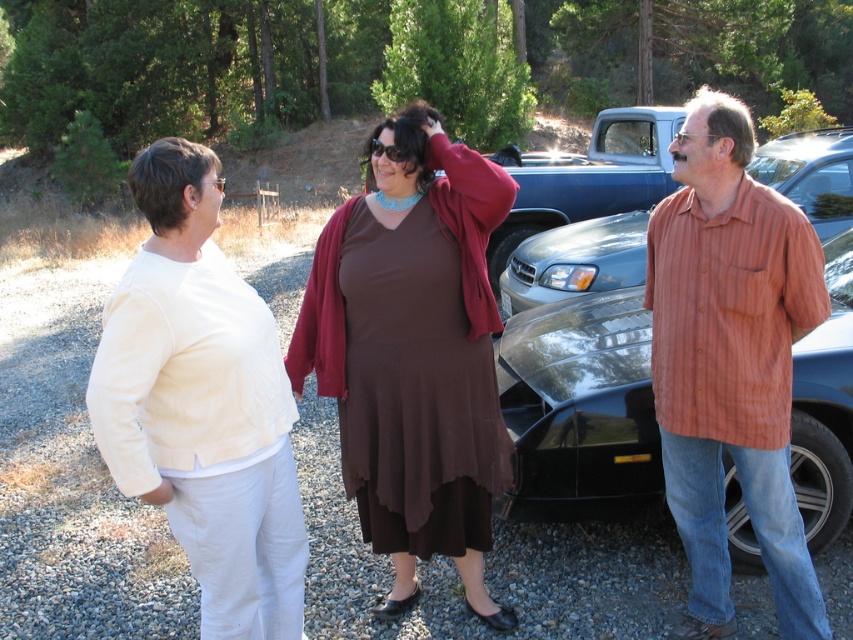
You are a photographer trying to capture a group photo of the two women in the scene. The camera you are using has a focus range that can only accommodate objects up to 1 meter in width. Given the brown matte dress at center and the black glossy car at center, will the camera be able to focus on both subjects simultaneously?

The brown matte dress at center is thinner than the black glossy car at center. Since the camera can focus on objects up to 1 meter in width, the dress is narrower than the car, but the total width of both together may exceed the camera range. However, the question specifies focusing on both subjects simultaneously. The car is wider than the dress, but the description only states the dress is thinner than the car, not the exact widths. Without knowing the car width, we can infer the dress is under 1m, but 2

You are standing in a gravel parking area and see two people wearing shirts. The first person is wearing a matte white shirt at left, and the second is wearing a striped cotton shirt at right. Which shirt is closer to you?

The matte white shirt at left is closer to the viewer than the striped cotton shirt at right.